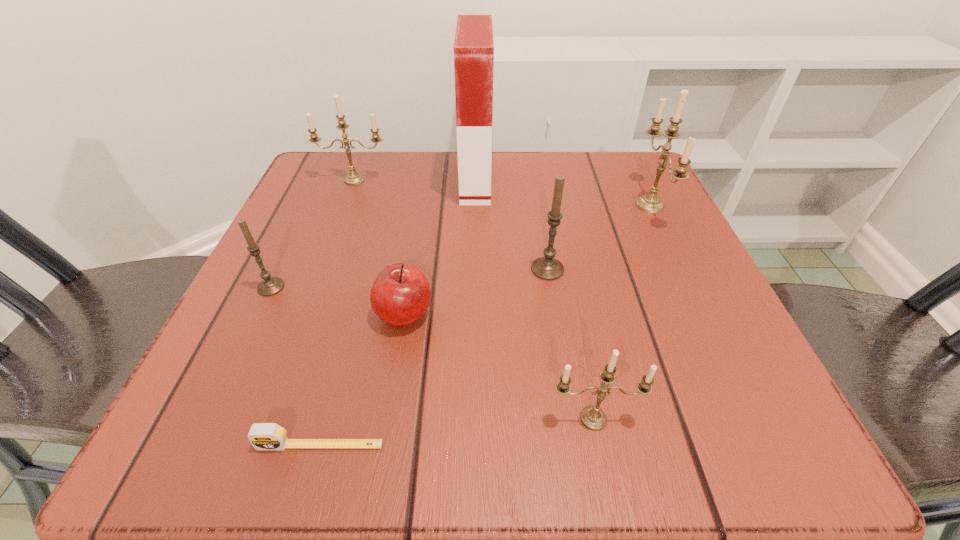
This screenshot has width=960, height=540. What are the coordinates of `cigarette_case located in the far edge section of the desktop` in the screenshot? It's located at (473, 46).

Where is `candle situated at the near edge`? candle situated at the near edge is located at coordinates (592, 417).

You are a GUI agent. You are given a task and a screenshot of the screen. Output one action in this format:
    pyautogui.click(x=<x>, y=<y>)
    Task: Click on the tape measure that is at the near edge
    This screenshot has width=960, height=540.
    Given the screenshot: What is the action you would take?
    pyautogui.click(x=263, y=436)

You are a GUI agent. You are given a task and a screenshot of the screen. Output one action in this format:
    pyautogui.click(x=<x>, y=<y>)
    Task: Click on the tape measure that is at the left edge
    The width and height of the screenshot is (960, 540).
    Given the screenshot: What is the action you would take?
    pyautogui.click(x=263, y=436)

Locate an element on the screen. object that is at the right edge is located at coordinates (651, 203).

Image resolution: width=960 pixels, height=540 pixels. Identify the location of object present at the far left corner. (353, 178).

Where is `object that is positioned at the near left corner`? This screenshot has width=960, height=540. object that is positioned at the near left corner is located at coordinates click(263, 436).

Where is `object positioned at the far right corner`? object positioned at the far right corner is located at coordinates (651, 203).

You are a GUI agent. You are given a task and a screenshot of the screen. Output one action in this format:
    pyautogui.click(x=<x>, y=<y>)
    Task: Click on the free location at the far edge
    The height and width of the screenshot is (540, 960).
    Given the screenshot: What is the action you would take?
    pyautogui.click(x=393, y=196)

The height and width of the screenshot is (540, 960). I want to click on free spot at the near edge of the desktop, so click(x=550, y=394).